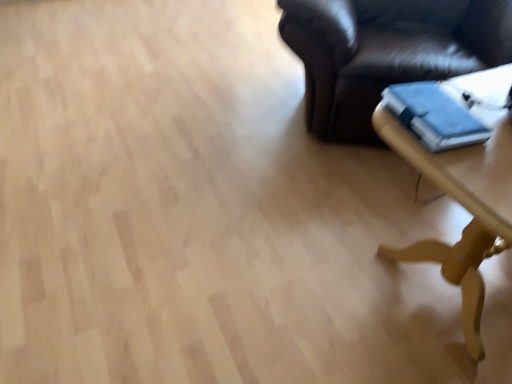
Find the location of a particular element. This screenshot has height=384, width=512. free spot in front of blue matte book at right is located at coordinates (467, 170).